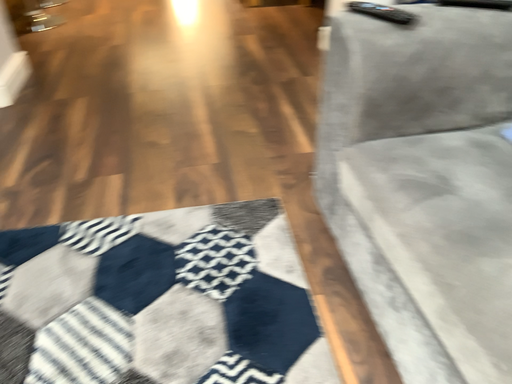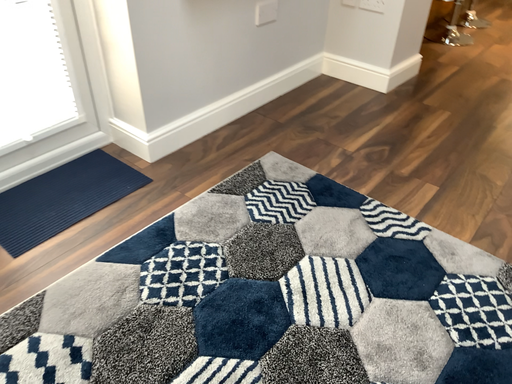
Question: How did the camera likely rotate when shooting the video?

Choices:
 (A) rotated right
 (B) rotated left

Answer: (B)